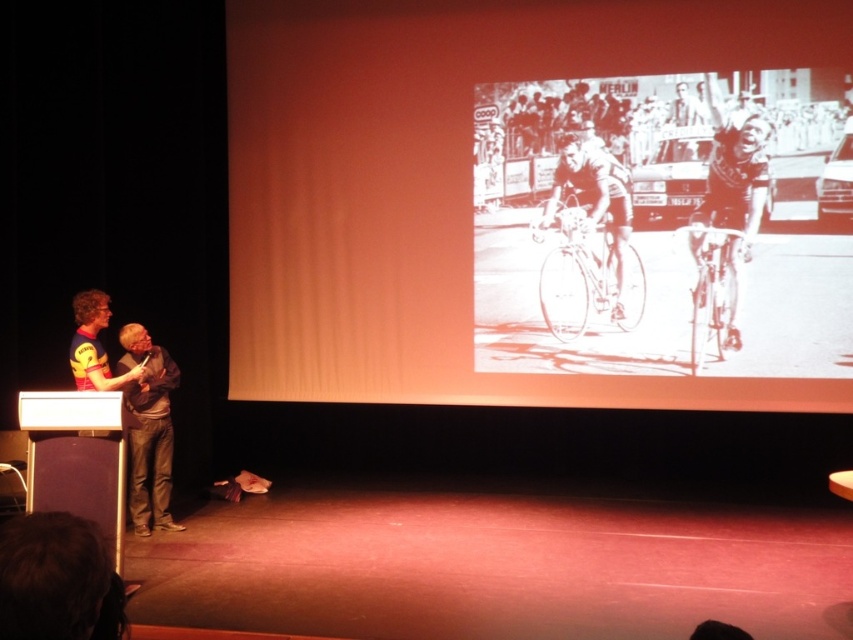
You are an event organizer who needs to ensure that all presenters are visible to the audience. Based on the scene description, which presenter should you adjust the lighting to focus on more, the matte black shirt at left or the yellow jersey at left?

The matte black shirt at left is bigger than the yellow jersey at left, so you should focus the lighting more on the matte black shirt at left to ensure it remains visible to the audience.

You are an event organizer who needs to ensure that all visual elements on the stage are properly arranged. Given the scene described, which object among the black and white drawing of cyclists at center and the smooth skin cyclist at center is taller?

The black and white drawing of cyclists at center is taller than the smooth skin cyclist at center.

You are an audience member sitting in the front row of the stage. You notice two presenters on the stage. Which presenter is positioned more to your left side, the matte black shirt at left or the yellow jersey at left?

The yellow jersey at left is positioned more to your left side because the matte black shirt at left is to the right of it.